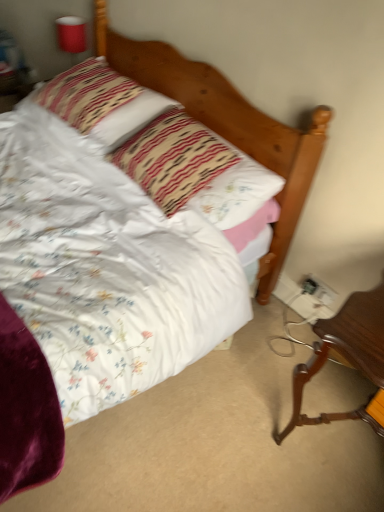
Question: Considering the relative sizes of brown polished wood desk at lower right and white plastic electrical outlet at lower right, which is the second electric outlet in right-to-left order, in the image provided, is brown polished wood desk at lower right smaller than white plastic electrical outlet at lower right, which is the second electric outlet in right-to-left order,?

Choices:
 (A) no
 (B) yes

Answer: (A)

Question: Does brown polished wood desk at lower right lie in front of white plastic electrical outlet at lower right, arranged as the first electric outlet when viewed from the left?

Choices:
 (A) yes
 (B) no

Answer: (A)

Question: Can you confirm if brown polished wood desk at lower right is shorter than white plastic electrical outlet at lower right, arranged as the first electric outlet when viewed from the left?

Choices:
 (A) yes
 (B) no

Answer: (B)

Question: Does brown polished wood desk at lower right have a lesser width compared to white plastic electrical outlet at lower right, arranged as the first electric outlet when viewed from the left?

Choices:
 (A) no
 (B) yes

Answer: (A)

Question: Does brown polished wood desk at lower right come behind white plastic electrical outlet at lower right, which is the second electric outlet in right-to-left order?

Choices:
 (A) no
 (B) yes

Answer: (A)

Question: Is brown polished wood desk at lower right not within white plastic electrical outlet at lower right, which is the second electric outlet in right-to-left order?

Choices:
 (A) yes
 (B) no

Answer: (A)

Question: Is floral fabric pillow at center, positioned as the second pillow in back-to-front order, smaller than striped fabric pillow at upper left, acting as the second pillow starting from the front?

Choices:
 (A) no
 (B) yes

Answer: (B)

Question: Would you say striped fabric pillow at upper left, which is counted as the 1th pillow, starting from the back, is part of floral fabric pillow at center, positioned as the second pillow in back-to-front order,'s contents?

Choices:
 (A) no
 (B) yes

Answer: (A)

Question: Can you confirm if floral fabric pillow at center, positioned as the second pillow in back-to-front order, is taller than striped fabric pillow at upper left, which is counted as the 1th pillow, starting from the back?

Choices:
 (A) no
 (B) yes

Answer: (B)

Question: Is floral fabric pillow at center, the first pillow positioned from the front, next to striped fabric pillow at upper left, acting as the second pillow starting from the front, and touching it?

Choices:
 (A) no
 (B) yes

Answer: (A)

Question: Is floral fabric pillow at center, the first pillow positioned from the front, to the left of striped fabric pillow at upper left, acting as the second pillow starting from the front, from the viewer's perspective?

Choices:
 (A) no
 (B) yes

Answer: (A)

Question: Does floral fabric pillow at center, positioned as the second pillow in back-to-front order, appear on the right side of striped fabric pillow at upper left, acting as the second pillow starting from the front?

Choices:
 (A) yes
 (B) no

Answer: (A)

Question: Does floral fabric pillow at center, the first pillow positioned from the front, appear on the right side of white plastic electrical outlet at lower right, which is the second electric outlet in right-to-left order?

Choices:
 (A) yes
 (B) no

Answer: (B)